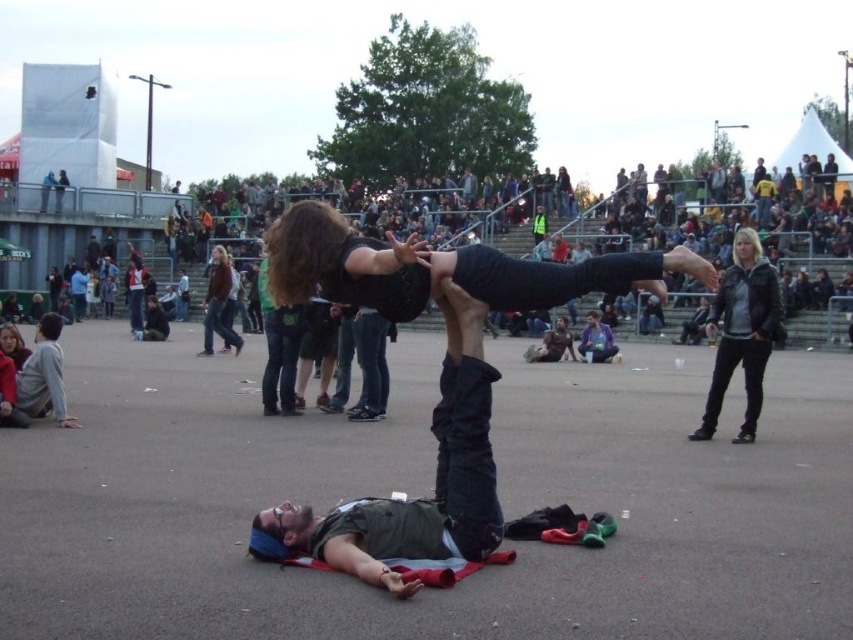
Question: Which point is closer to the camera taking this photo?

Choices:
 (A) (494, 490)
 (B) (717, 404)
 (C) (67, 422)

Answer: (A)

Question: Is light gray sweatshirt at lower left bigger than denim jacket at center?

Choices:
 (A) no
 (B) yes

Answer: (A)

Question: From the image, what is the correct spatial relationship of black leather jacket at upper right in relation to denim jacket at center?

Choices:
 (A) left
 (B) right

Answer: (B)

Question: Which of the following is the farthest from the observer?

Choices:
 (A) (51, 339)
 (B) (724, 348)

Answer: (B)

Question: Can you confirm if black leather jacket at upper right is wider than denim jacket at center?

Choices:
 (A) no
 (B) yes

Answer: (B)

Question: Which of the following is the closest to the observer?

Choices:
 (A) (450, 493)
 (B) (764, 360)

Answer: (A)